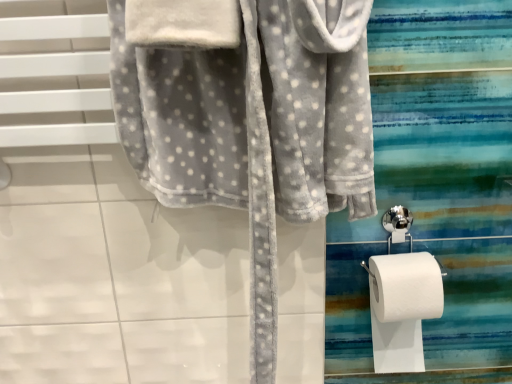
Question: Is point (274, 67) positioned closer to the camera than point (373, 264)?

Choices:
 (A) closer
 (B) farther

Answer: (A)

Question: From a real-world perspective, is soft gray fleece robe at center positioned above or below white paper at right?

Choices:
 (A) above
 (B) below

Answer: (A)

Question: Would you say soft gray fleece robe at center is inside or outside white paper at right?

Choices:
 (A) inside
 (B) outside

Answer: (B)

Question: Based on their positions, is white paper at right located to the left or right of soft gray fleece robe at center?

Choices:
 (A) right
 (B) left

Answer: (A)

Question: Looking at the image, does white paper at right seem bigger or smaller compared to soft gray fleece robe at center?

Choices:
 (A) big
 (B) small

Answer: (B)

Question: In the image, is white paper at right positioned in front of or behind soft gray fleece robe at center?

Choices:
 (A) front
 (B) behind

Answer: (B)

Question: In terms of height, does white paper at right look taller or shorter compared to soft gray fleece robe at center?

Choices:
 (A) tall
 (B) short

Answer: (B)